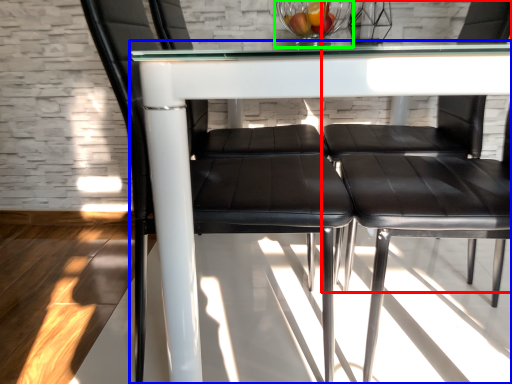
Question: Which object is positioned closest to chair (highlighted by a red box)? Select from table (highlighted by a blue box) and glass bowl (highlighted by a green box).

Choices:
 (A) table
 (B) glass bowl

Answer: (B)